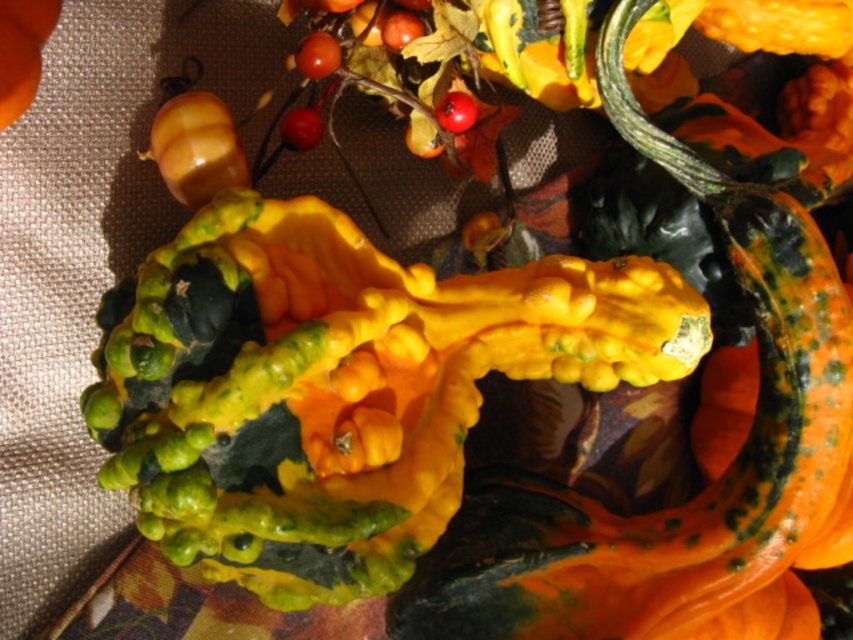
Question: Can you confirm if glossy red berry at upper center is positioned above glossy red berry at center?

Choices:
 (A) no
 (B) yes

Answer: (B)

Question: Based on their relative distances, which object is nearer to the matte orange pumpkin at upper left?

Choices:
 (A) glossy red berry at center
 (B) shiny red berry at center
 (C) shiny brown onion at upper left

Answer: (C)

Question: Which object is positioned closest to the shiny red berry at center?

Choices:
 (A) shiny brown onion at upper left
 (B) glossy red berry at center
 (C) matte orange pumpkin at upper left

Answer: (A)

Question: Which object appears farthest from the camera in this image?

Choices:
 (A) matte orange pumpkin at upper left
 (B) glossy red berry at center

Answer: (B)

Question: Does shiny brown onion at upper left have a larger size compared to glossy red berry at center?

Choices:
 (A) yes
 (B) no

Answer: (A)

Question: Is speckled orange gourd at center to the right of glossy red berry at upper center from the viewer's perspective?

Choices:
 (A) yes
 (B) no

Answer: (A)